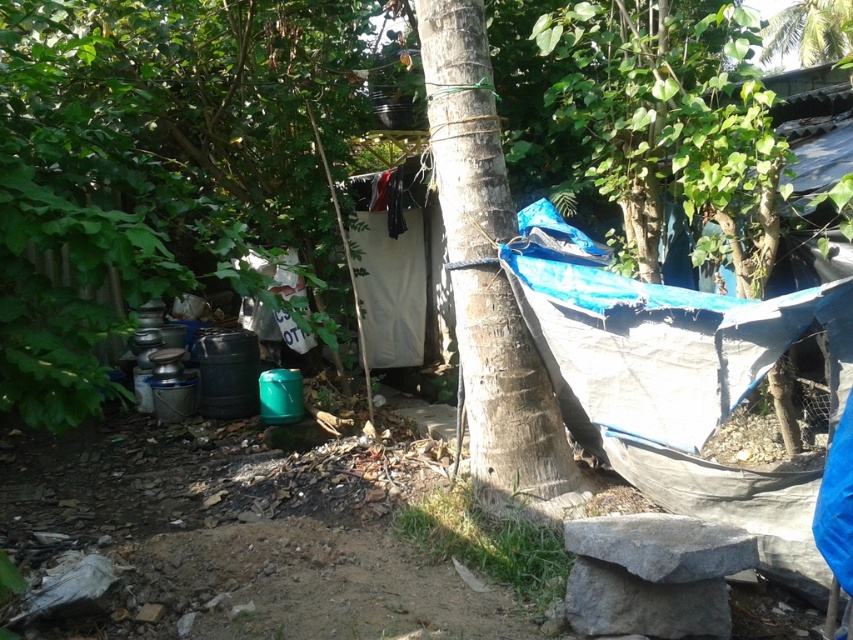
Question: Where is rough bark tree at center located in relation to green leafy tree at upper right in the image?

Choices:
 (A) above
 (B) below

Answer: (B)

Question: Which point is closer to the camera?

Choices:
 (A) (625, 408)
 (B) (785, 49)
 (C) (415, 333)
 (D) (494, 442)

Answer: (A)

Question: Considering the real-world distances, which object is closest to the green leafy tree at upper right?

Choices:
 (A) white fabric at center
 (B) blue tarp at center
 (C) rough bark tree at center

Answer: (A)

Question: Estimate the real-world distances between objects in this image. Which object is farther from the green leafy tree at upper right?

Choices:
 (A) rough bark tree at center
 (B) white fabric at center

Answer: (A)

Question: Is rough bark tree at center bigger than green leafy tree at upper right?

Choices:
 (A) yes
 (B) no

Answer: (A)

Question: Does blue tarp at center appear under green leafy tree at upper right?

Choices:
 (A) no
 (B) yes

Answer: (B)